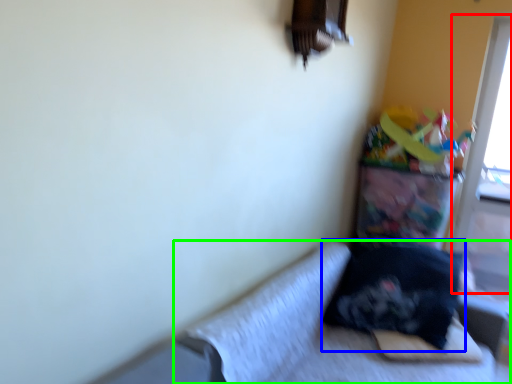
Question: Which object is positioned farthest from screen door (highlighted by a red box)? Select from pillow (highlighted by a blue box) and studio couch (highlighted by a green box).

Choices:
 (A) pillow
 (B) studio couch

Answer: (B)